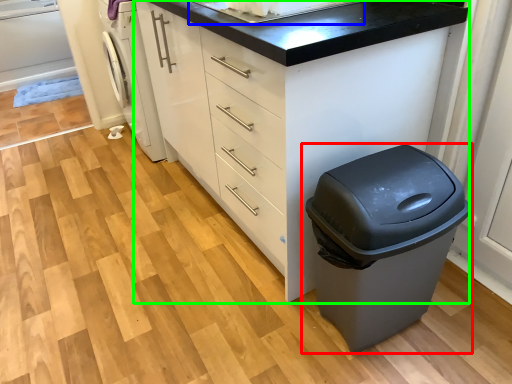
Question: Which is farther away from waste container (highlighted by a red box)? sink (highlighted by a blue box) or chest of drawers (highlighted by a green box)?

Choices:
 (A) sink
 (B) chest of drawers

Answer: (A)